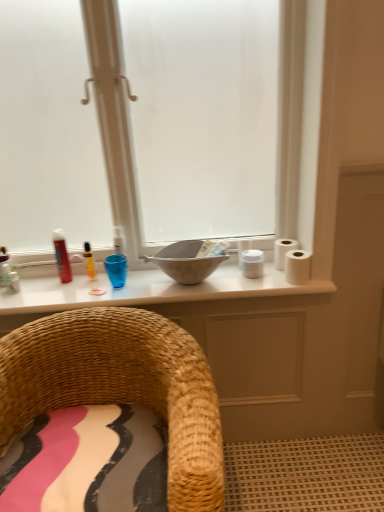
Question: From a real-world perspective, is white matte toilet paper at right, the 2th toilet paper viewed from the front, positioned under matte glass window at center based on gravity?

Choices:
 (A) no
 (B) yes

Answer: (B)

Question: Is white matte toilet paper at right, the 2th toilet paper viewed from the front, facing towards matte glass window at center?

Choices:
 (A) no
 (B) yes

Answer: (B)

Question: Is white matte toilet paper at right, the first toilet paper viewed from the back, thinner than matte glass window at center?

Choices:
 (A) no
 (B) yes

Answer: (B)

Question: Can you confirm if white matte toilet paper at right, the 2th toilet paper viewed from the front, is shorter than matte glass window at center?

Choices:
 (A) yes
 (B) no

Answer: (A)

Question: From a real-world perspective, is white matte toilet paper at right, the first toilet paper viewed from the back, on top of matte glass window at center?

Choices:
 (A) yes
 (B) no

Answer: (B)

Question: Can you confirm if white matte toilet paper at right, the 2th toilet paper viewed from the front, is bigger than matte glass window at center?

Choices:
 (A) yes
 (B) no

Answer: (B)

Question: Does white matte toilet paper at right, the 2th toilet paper viewed from the front, have a smaller size compared to matte white countertop at center?

Choices:
 (A) yes
 (B) no

Answer: (A)

Question: Is white matte toilet paper at right, the first toilet paper viewed from the back, oriented away from matte white countertop at center?

Choices:
 (A) yes
 (B) no

Answer: (B)

Question: Is the depth of white matte toilet paper at right, the first toilet paper viewed from the back, greater than that of matte white countertop at center?

Choices:
 (A) no
 (B) yes

Answer: (B)

Question: Does white matte toilet paper at right, the first toilet paper viewed from the back, lie in front of matte white countertop at center?

Choices:
 (A) yes
 (B) no

Answer: (B)

Question: Does white matte toilet paper at right, the first toilet paper viewed from the back, have a lesser width compared to matte white countertop at center?

Choices:
 (A) no
 (B) yes

Answer: (B)

Question: Would you consider white matte toilet paper at right, the 2th toilet paper viewed from the front, to be distant from matte white countertop at center?

Choices:
 (A) no
 (B) yes

Answer: (A)

Question: Can you confirm if matte red can at left, the 1th toiletry viewed from the left, is positioned to the left of yellow plastic marker at upper center, which ranks as the first toiletry in right-to-left order?

Choices:
 (A) no
 (B) yes

Answer: (B)